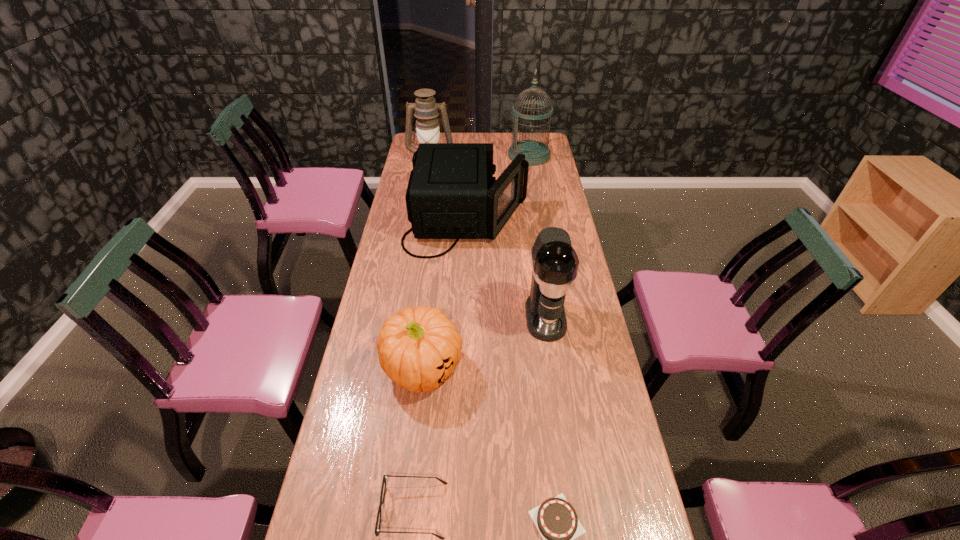
At what (x,y) coordinates should I click in order to perform the action: click on vacant space at the left edge. Please return your answer as a coordinate pair (x, y). The width and height of the screenshot is (960, 540). Looking at the image, I should click on (353, 423).

This screenshot has height=540, width=960. I want to click on vacant space at the right edge, so click(634, 514).

Where is `vacant space in between the coffee maker and the microwave oven`? The height and width of the screenshot is (540, 960). vacant space in between the coffee maker and the microwave oven is located at coordinates (506, 268).

Identify the location of object that ranks as the fourth closest to the shortest object. The width and height of the screenshot is (960, 540). (451, 194).

Choose which object is the sixth nearest neighbor to the third farthest object. Please provide its 2D coordinates. Your answer should be formatted as a tuple, i.e. [(x, y)], where the tuple contains the x and y coordinates of a point satisfying the conditions above.

[(556, 520)]

The height and width of the screenshot is (540, 960). What are the coordinates of `free space that satisfies the following two spatial constraints: 1. on the front-facing side of the tallest object; 2. place cup under the spout of the coffee maker` in the screenshot? It's located at (556, 316).

Locate an element on the screen. The image size is (960, 540). blank space that satisfies the following two spatial constraints: 1. on the front-facing side of the birdcage; 2. on the front side of the oil lamp is located at coordinates (530, 161).